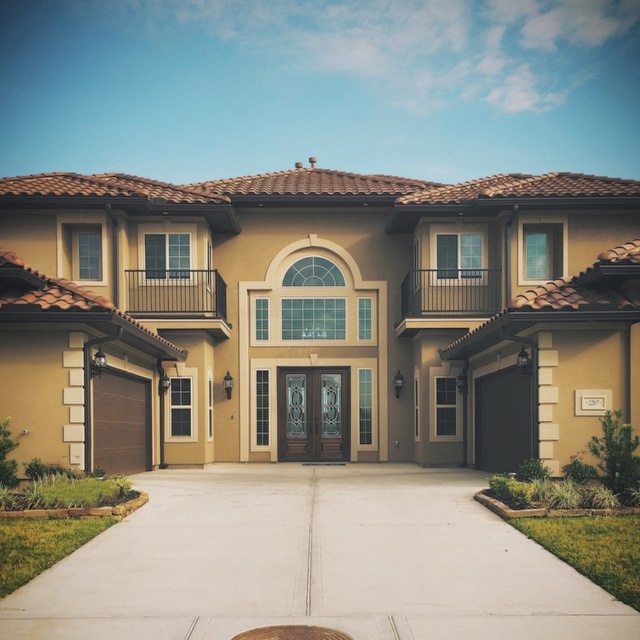
Can you confirm if concrete at center is positioned to the left of metallic gray manhole cover at center?

Yes, concrete at center is to the left of metallic gray manhole cover at center.

Does concrete at center appear on the right side of metallic gray manhole cover at center?

In fact, concrete at center is to the left of metallic gray manhole cover at center.

Which is in front, point (291, 467) or point (275, 630)?

Point (275, 630) is more forward.

Where is `concrete at center`? The width and height of the screenshot is (640, 640). concrete at center is located at coordinates (312, 563).